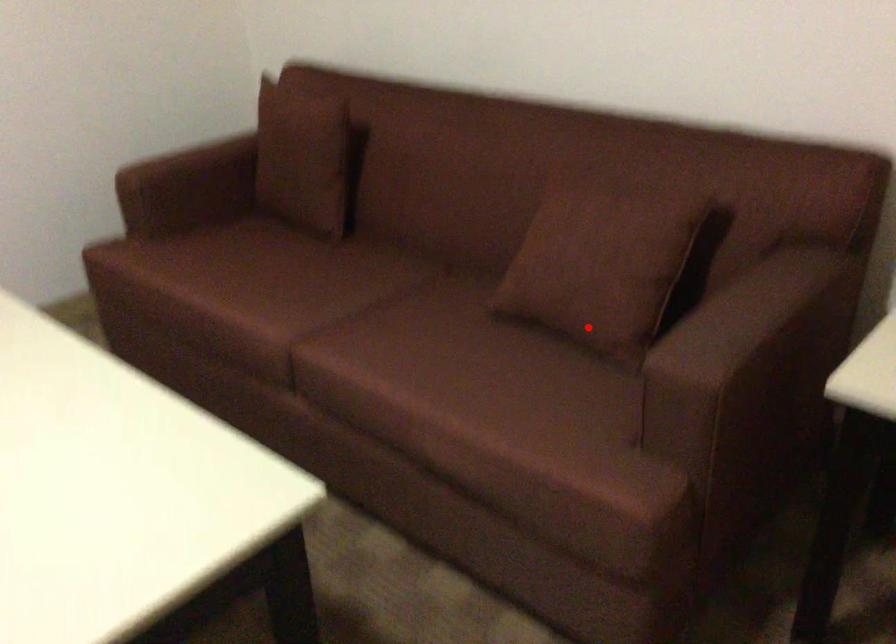
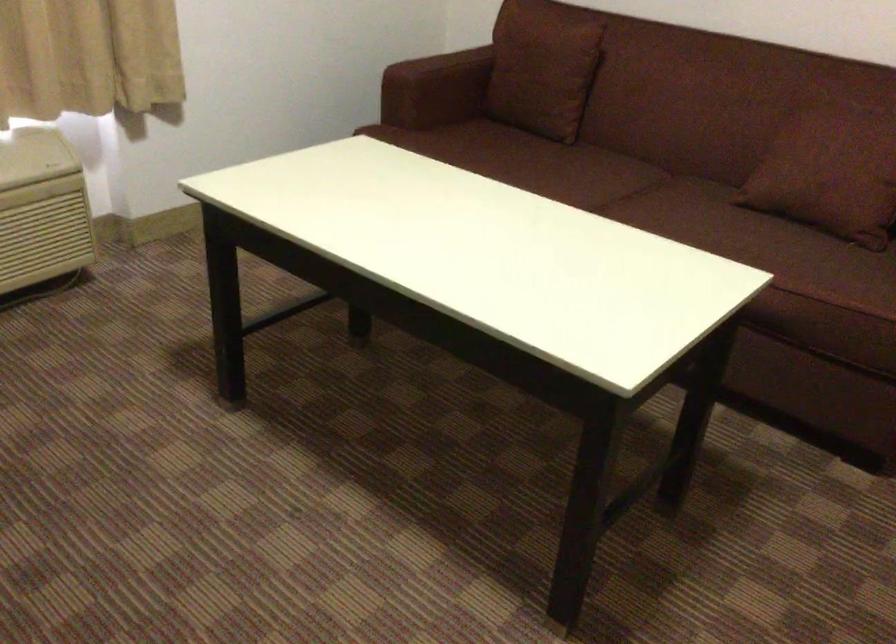
Where in the second image is the point corresponding to the highlighted location from the first image?

(842, 207)